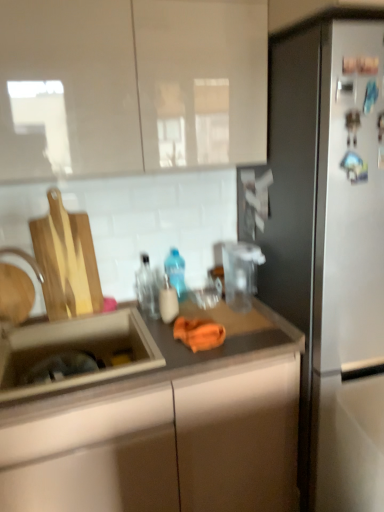
Question: From a real-world perspective, is stainless steel refrigerator at right above or below transparent glass bottle at center, the second bottle when ordered from back to front?

Choices:
 (A) below
 (B) above

Answer: (A)

Question: Relative to transparent glass bottle at center, which is the second bottle from front to back, is stainless steel refrigerator at right in front or behind?

Choices:
 (A) front
 (B) behind

Answer: (A)

Question: Based on their relative distances, which object is farther from the matte brown countertop at center?

Choices:
 (A) transparent glass bottle at center, which is the second bottle from front to back
 (B) matte plastic soap dispenser at center, marked as the third bottle in a back-to-front arrangement
 (C) brushed metal faucet at sink left
 (D) stainless steel refrigerator at right
 (E) glossy white cabinet at upper center

Answer: (E)

Question: Which of these objects is positioned closest to the blue translucent bottle at center, which ranks as the 3th bottle in front-to-back order?

Choices:
 (A) glossy white cabinet at upper center
 (B) matte plastic soap dispenser at center, marked as the first bottle in a front-to-back arrangement
 (C) brushed metal faucet at sink left
 (D) transparent glass bottle at center, the second bottle when ordered from back to front
 (E) stainless steel refrigerator at right

Answer: (D)